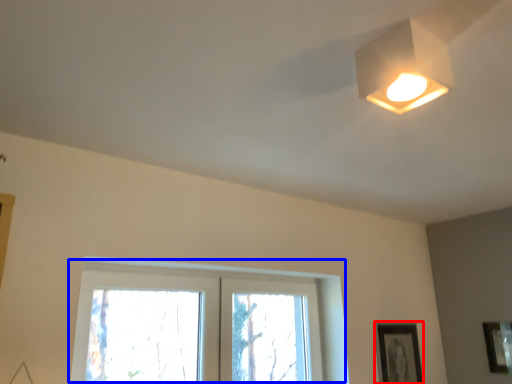
Question: Which object appears closest to the camera in this image, picture frame (highlighted by a red box) or window (highlighted by a blue box)?

Choices:
 (A) picture frame
 (B) window

Answer: (B)